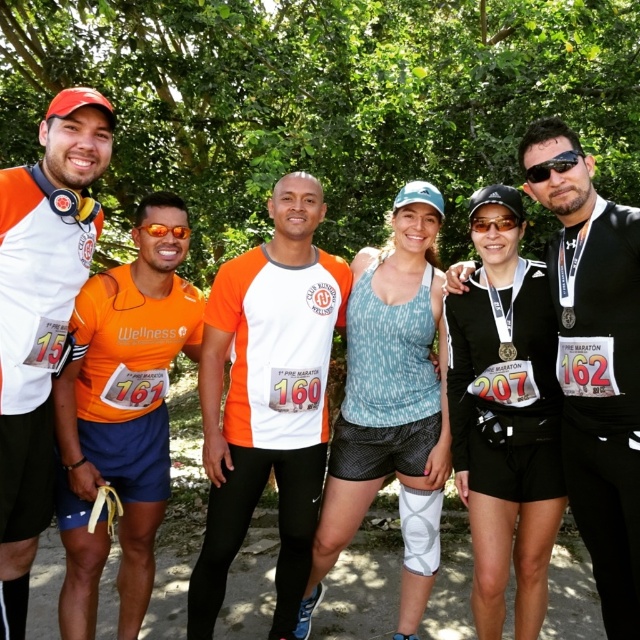
Who is shorter, textured orange tank top at center or matte orange t-shirt at left?

matte orange t-shirt at left

Is textured orange tank top at center wider than matte orange t-shirt at left?

Yes.

Is point (420, 609) in front of point (81, 157)?

No, it is behind (81, 157).

Where is `textured orange tank top at center`? The width and height of the screenshot is (640, 640). textured orange tank top at center is located at coordinates (390, 406).

Between black matte jacket at center and gold metallic medal at center, which one is positioned higher?

Positioned higher is gold metallic medal at center.

Does point (568, 365) come in front of point (499, 342)?

That is True.

Identify the location of black matte jacket at center. (598, 380).

Between black matte jacket at center and matte orange t-shirt at left, which one appears on the right side from the viewer's perspective?

black matte jacket at center is more to the right.

Who is more forward, [586,195] or [86,204]?

Positioned in front is point [586,195].

Find the location of `black matte jacket at center`. black matte jacket at center is located at coordinates pos(598,380).